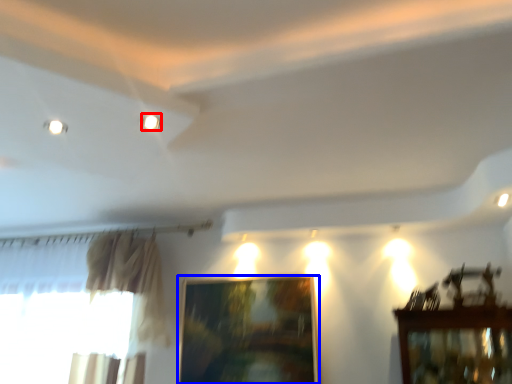
Question: Among these objects, which one is farthest to the camera, lighting (highlighted by a red box) or picture frame (highlighted by a blue box)?

Choices:
 (A) lighting
 (B) picture frame

Answer: (B)